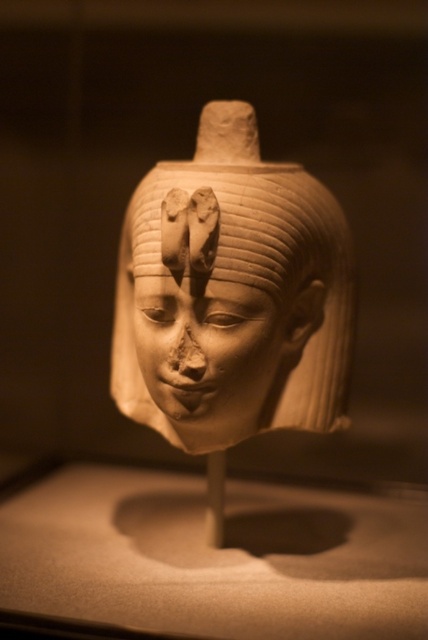
Question: Which point is farther to the camera?

Choices:
 (A) matte beige statue at center
 (B) matte beige face at center

Answer: (B)

Question: Does matte beige statue at center have a greater width compared to matte beige face at center?

Choices:
 (A) yes
 (B) no

Answer: (A)

Question: Can you confirm if matte beige statue at center is bigger than matte beige face at center?

Choices:
 (A) yes
 (B) no

Answer: (A)

Question: Which of the following is the closest to the observer?

Choices:
 (A) (318, 339)
 (B) (219, 292)

Answer: (B)

Question: Does matte beige statue at center appear on the right side of matte beige face at center?

Choices:
 (A) yes
 (B) no

Answer: (A)